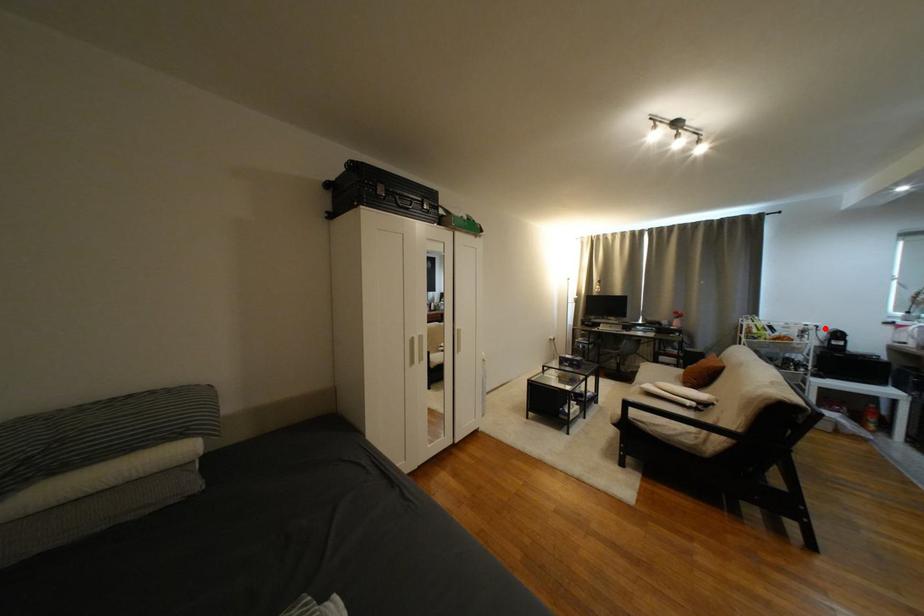
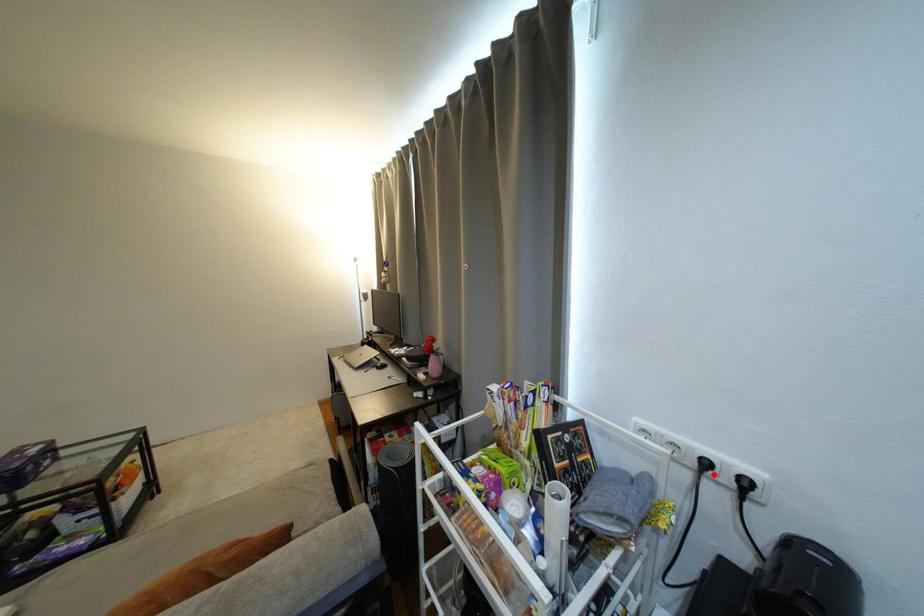
I am providing you with two images of the same scene from different viewpoints. A red point is marked on the first image and another point is marked on the second image. Do the highlighted points in image1 and image2 indicate the same real-world spot?

No